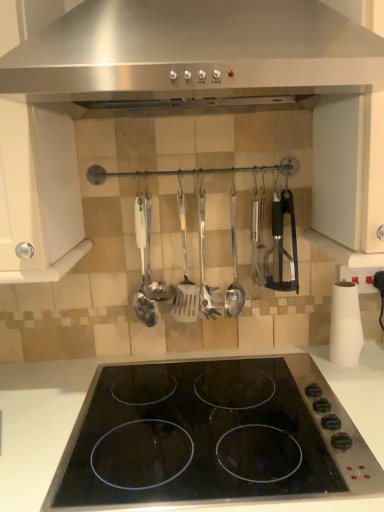
Question: Can you confirm if black glass electric stove at center is positioned to the right of satin silver spatula at center, which is the 1th spatula from right to left?

Choices:
 (A) yes
 (B) no

Answer: (B)

Question: Is black glass electric stove at center in contact with satin silver spatula at center, which is the 1th spatula from right to left?

Choices:
 (A) no
 (B) yes

Answer: (A)

Question: From the image's perspective, is black glass electric stove at center located above satin silver spatula at center, which is the 1th spatula from right to left?

Choices:
 (A) yes
 (B) no

Answer: (B)

Question: Does black glass electric stove at center have a smaller size compared to satin silver spatula at center, the third spatula in the left-to-right sequence?

Choices:
 (A) no
 (B) yes

Answer: (A)

Question: From a real-world perspective, is black glass electric stove at center located higher than satin silver spatula at center, which is the 1th spatula from right to left?

Choices:
 (A) no
 (B) yes

Answer: (A)

Question: Is satin silver spatula at center, the third spatula in the left-to-right sequence, at the back of black glass electric stove at center?

Choices:
 (A) yes
 (B) no

Answer: (B)

Question: Is satin silver spoon at center bigger than satin silver spatula at center, which is the second spatula from right to left?

Choices:
 (A) yes
 (B) no

Answer: (A)

Question: Does satin silver spoon at center have a greater height compared to satin silver spatula at center, which is the 2th spatula from left to right?

Choices:
 (A) yes
 (B) no

Answer: (B)

Question: Is satin silver spoon at center outside satin silver spatula at center, which is the 2th spatula from left to right?

Choices:
 (A) yes
 (B) no

Answer: (A)

Question: Would you consider satin silver spoon at center to be distant from satin silver spatula at center, which is the 2th spatula from left to right?

Choices:
 (A) no
 (B) yes

Answer: (A)

Question: Is satin silver spoon at center in contact with satin silver spatula at center, which is the second spatula from right to left?

Choices:
 (A) yes
 (B) no

Answer: (A)

Question: Is satin silver spoon at center positioned before satin silver spatula at center, which is the 2th spatula from left to right?

Choices:
 (A) no
 (B) yes

Answer: (B)

Question: Is satin silver spatula at center, the 3th spatula from the right, behind satin silver spatula at center, which is the 2th spatula from left to right?

Choices:
 (A) yes
 (B) no

Answer: (B)